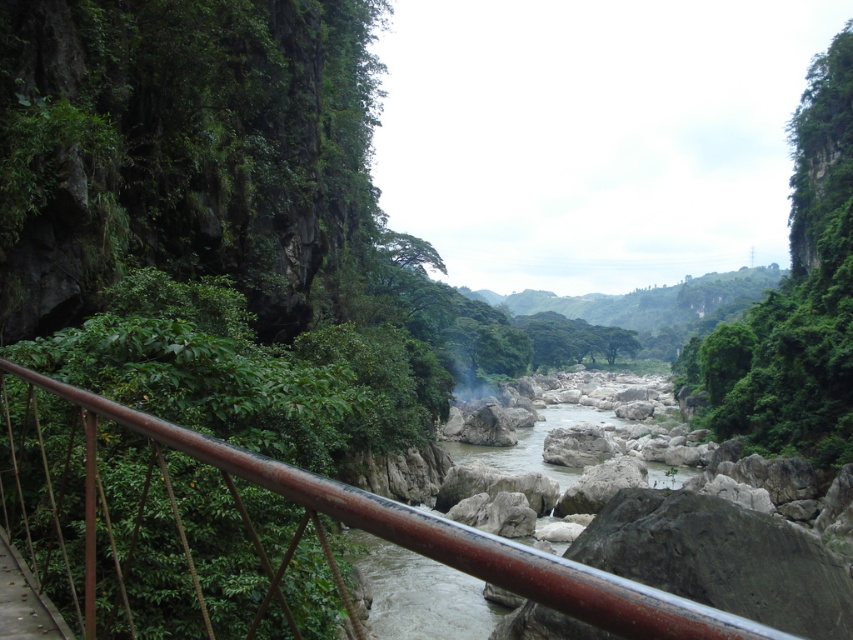
Between rusty metal railing at lower left and white smooth rocks at center, which one is positioned higher?

rusty metal railing at lower left

Is rusty metal railing at lower left smaller than white smooth rocks at center?

Correct, rusty metal railing at lower left occupies less space than white smooth rocks at center.

Where is `rusty metal railing at lower left`? The height and width of the screenshot is (640, 853). rusty metal railing at lower left is located at coordinates (440, 536).

Is green leafy vegetation at upper center closer to the viewer compared to white smooth rocks at center?

No, it is behind white smooth rocks at center.

Who is positioned more to the left, green leafy vegetation at upper center or white smooth rocks at center?

From the viewer's perspective, white smooth rocks at center appears more on the left side.

What do you see at coordinates (798, 298) in the screenshot?
I see `green leafy vegetation at upper center` at bounding box center [798, 298].

I want to click on green leafy vegetation at upper center, so click(798, 298).

Which is behind, point (762, 412) or point (148, 435)?

Point (762, 412)

Where is `green leafy vegetation at upper center`? This screenshot has height=640, width=853. green leafy vegetation at upper center is located at coordinates (798, 298).